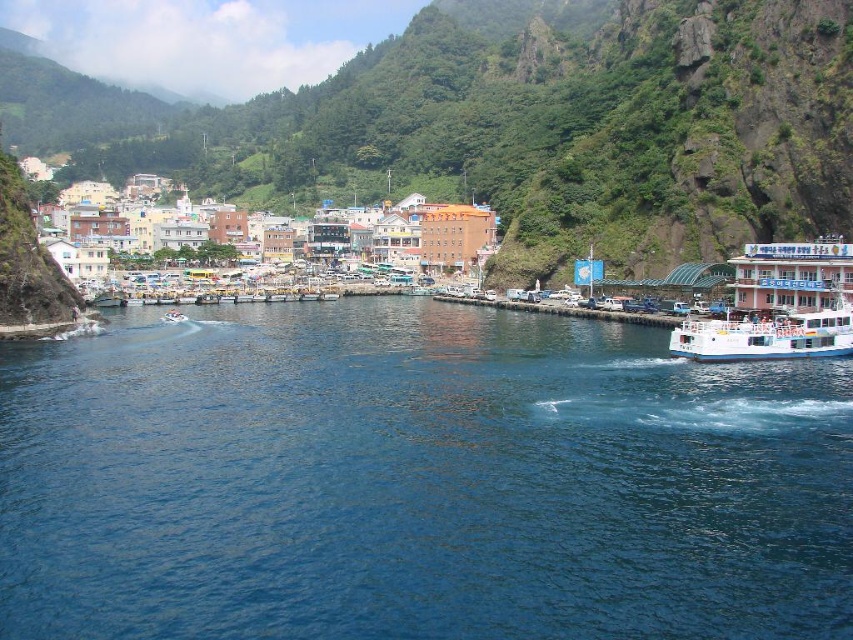
Question: Which of these objects is positioned closest to the white glossy ferry at right?

Choices:
 (A) rough rock mountain at upper center
 (B) white glossy boat at lower left

Answer: (B)

Question: Can you confirm if blue liquid water at center is smaller than rough rock mountain at upper center?

Choices:
 (A) no
 (B) yes

Answer: (B)

Question: Which point is closer to the camera?

Choices:
 (A) (149, 580)
 (B) (170, 320)
 (C) (438, 248)

Answer: (A)

Question: Is orange matte building at center positioned at the back of white glossy boat at lower left?

Choices:
 (A) yes
 (B) no

Answer: (A)

Question: Is white glossy ferry at right wider than white glossy boat at lower left?

Choices:
 (A) no
 (B) yes

Answer: (B)

Question: Which of the following is the farthest from the observer?

Choices:
 (A) (403, 240)
 (B) (76, 548)
 (C) (181, 316)
 (D) (756, 148)

Answer: (A)